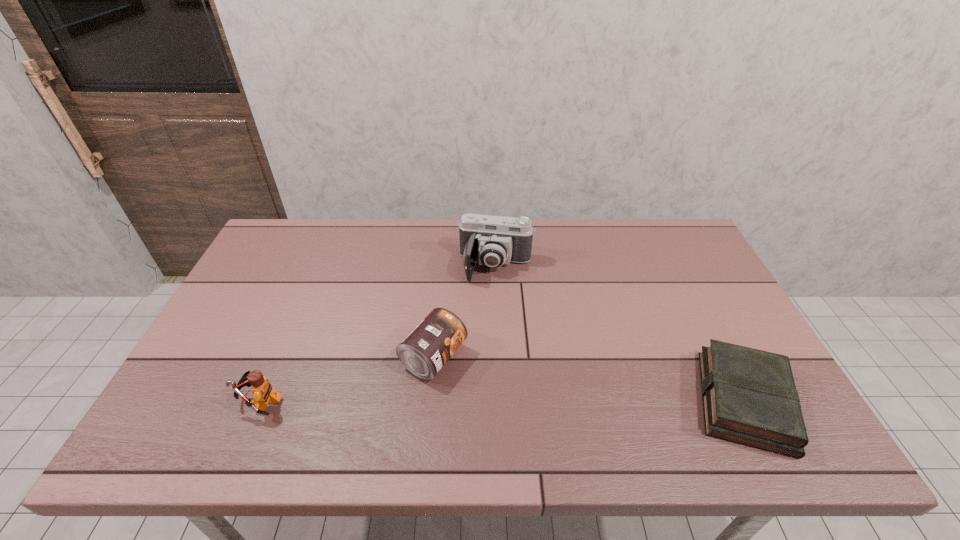
I want to click on vacant spot on the desktop that is between the Lego and the shortest object and is positioned at the front of the tallest object with an open lens cover, so click(469, 401).

I want to click on free space on the desktop that is between the leftmost object and the book and is positioned on the front label of the can, so click(x=518, y=401).